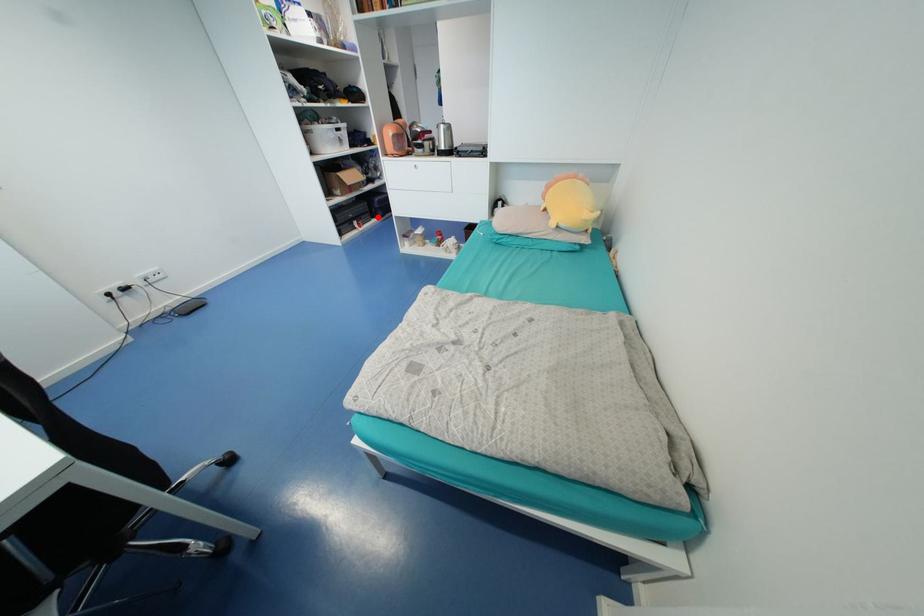
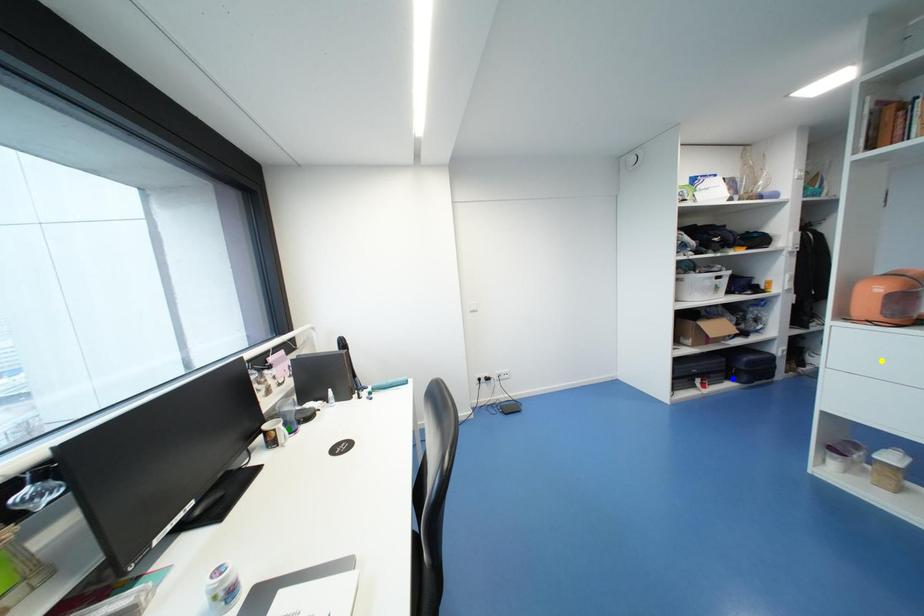
Question: I am providing you with two images of the same scene from different viewpoints. A red point is marked on the first image. You are given multiple points on the second image. Which point in image 2 represents the same 3d spot as the red point in image 1?

Choices:
 (A) yellow point
 (B) green point
 (C) blue point

Answer: (C)